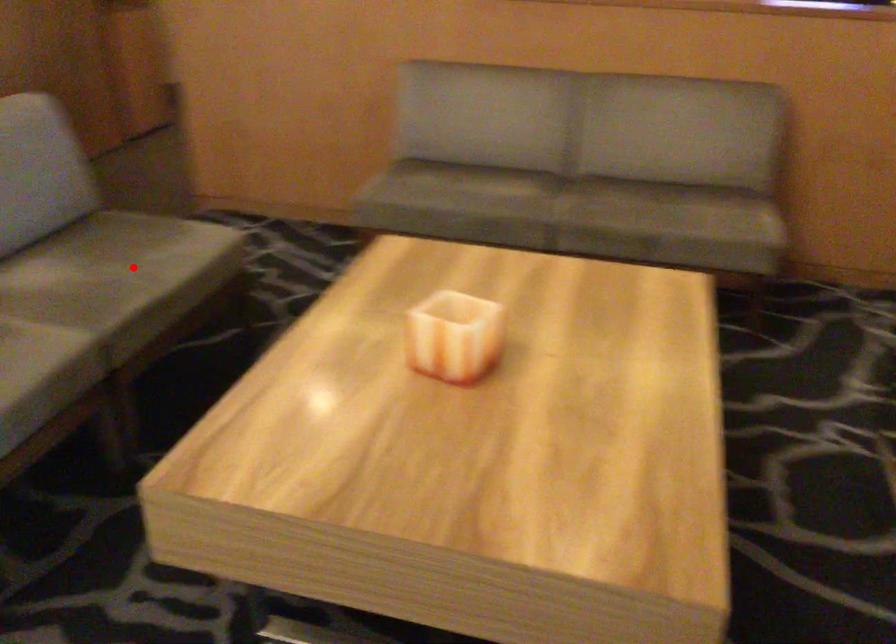
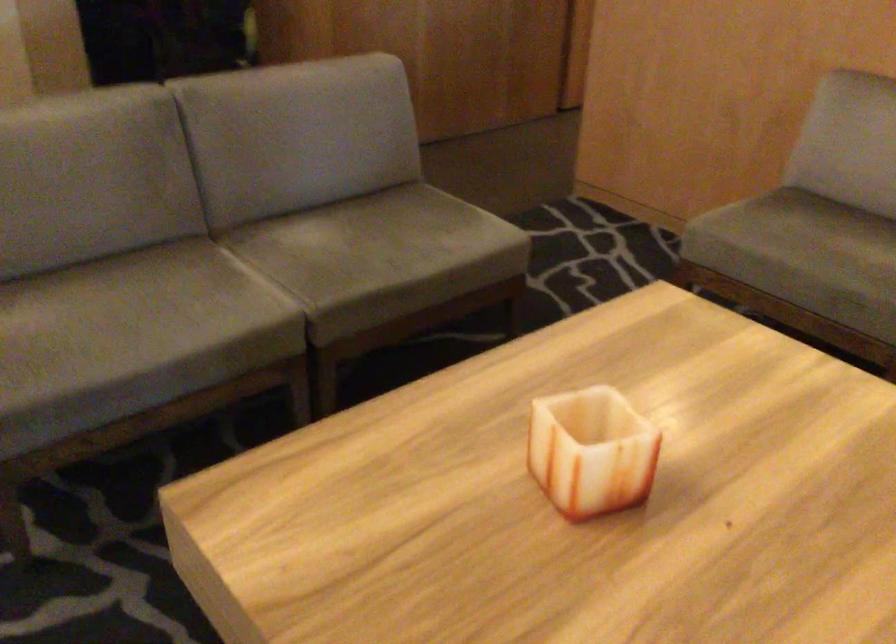
Find the pixel in the second image that matches the highlighted location in the first image.

(385, 247)